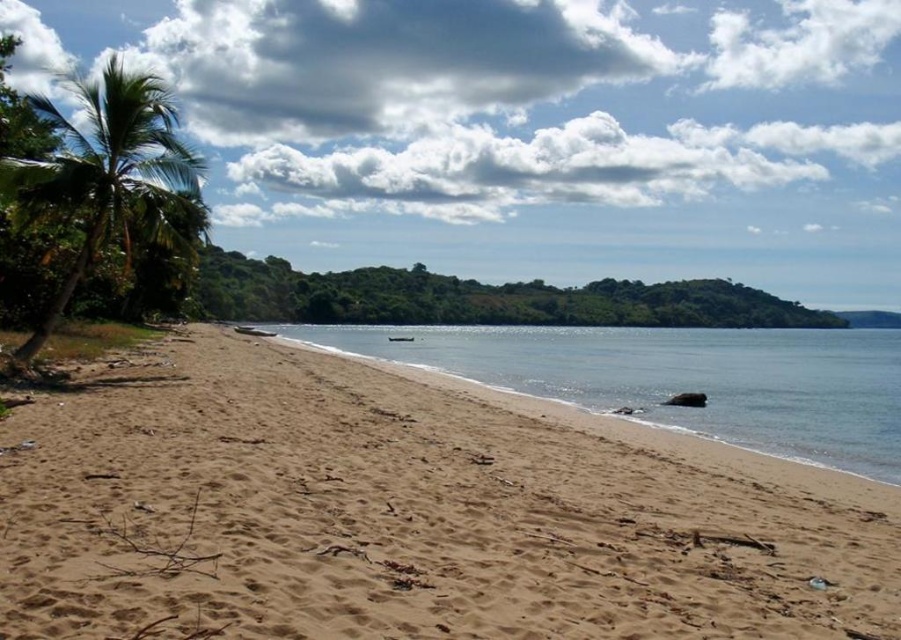
Question: Is sandy beach at lower left behind clear blue water at center?

Choices:
 (A) no
 (B) yes

Answer: (A)

Question: Does sandy beach at lower left have a greater width compared to green leafy palm tree at left?

Choices:
 (A) no
 (B) yes

Answer: (A)

Question: Can you confirm if clear blue water at center is positioned below green leafy palm tree at left?

Choices:
 (A) yes
 (B) no

Answer: (A)

Question: Based on their relative distances, which object is nearer to the sandy beach at lower left?

Choices:
 (A) green leafy palm tree at left
 (B) clear blue water at center

Answer: (A)

Question: Which object is farther from the camera taking this photo?

Choices:
 (A) sandy beach at lower left
 (B) clear blue water at center

Answer: (B)

Question: Which object is farther from the camera taking this photo?

Choices:
 (A) green leafy palm tree at left
 (B) sandy beach at lower left
 (C) clear blue water at center

Answer: (A)